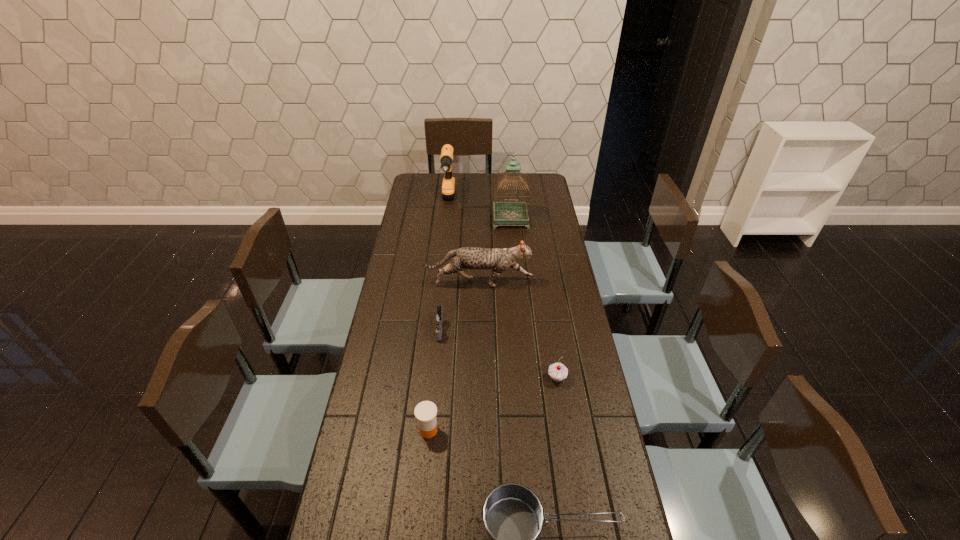
You are a GUI agent. You are given a task and a screenshot of the screen. Output one action in this format:
    pyautogui.click(x=<x>, y=<y>)
    Task: Click on the vacant area at the right edge of the desktop
    The height and width of the screenshot is (540, 960).
    Given the screenshot: What is the action you would take?
    pyautogui.click(x=626, y=518)

Where is `vacant region at the far left corner of the desktop`? vacant region at the far left corner of the desktop is located at coordinates (420, 182).

At what (x,y) coordinates should I click in order to perform the action: click on vacant area at the far right corner of the desktop. Please return your answer as a coordinate pair (x, y). Looking at the image, I should click on (534, 183).

Where is `vacant area that lies between the cupcake and the cat`? Image resolution: width=960 pixels, height=540 pixels. vacant area that lies between the cupcake and the cat is located at coordinates (517, 330).

Image resolution: width=960 pixels, height=540 pixels. I want to click on vacant space in between the cupcake and the drill, so [502, 290].

Where is `empty space that is in between the birdcage and the medicine`? empty space that is in between the birdcage and the medicine is located at coordinates (469, 325).

Where is `free space between the igniter and the tallest object`? free space between the igniter and the tallest object is located at coordinates (475, 274).

This screenshot has height=540, width=960. What are the coordinates of `free spot between the drill and the igniter` in the screenshot? It's located at (444, 266).

At what (x,y) coordinates should I click in order to perform the action: click on blank region between the sixth farthest object and the fifth nearest object. Please return your answer as a coordinate pair (x, y). The height and width of the screenshot is (540, 960). Looking at the image, I should click on (453, 356).

The image size is (960, 540). Identify the location of free space between the fourth nearest object and the cupcake. (498, 354).